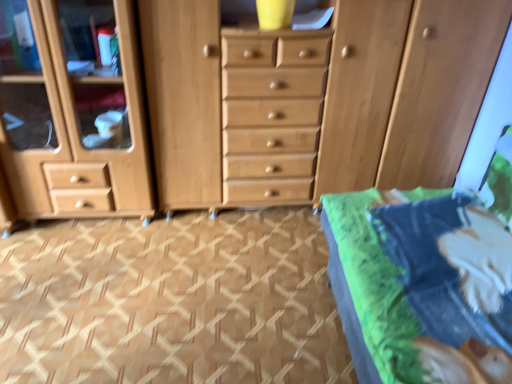
Question: From the image's perspective, is green fabric bed at lower right under brown textured carpet at center?

Choices:
 (A) no
 (B) yes

Answer: (A)

Question: Could you tell me if green fabric bed at lower right is turned towards brown textured carpet at center?

Choices:
 (A) no
 (B) yes

Answer: (B)

Question: From a real-world perspective, is green fabric bed at lower right positioned over brown textured carpet at center based on gravity?

Choices:
 (A) no
 (B) yes

Answer: (B)

Question: Is green fabric bed at lower right next to brown textured carpet at center?

Choices:
 (A) yes
 (B) no

Answer: (B)

Question: Does green fabric bed at lower right have a lesser height compared to brown textured carpet at center?

Choices:
 (A) yes
 (B) no

Answer: (B)

Question: Considering the positions of green fabric bed at lower right and brown textured carpet at center in the image, is green fabric bed at lower right bigger or smaller than brown textured carpet at center?

Choices:
 (A) big
 (B) small

Answer: (A)

Question: Considering the positions of point (429, 193) and point (150, 233), is point (429, 193) closer or farther from the camera than point (150, 233)?

Choices:
 (A) farther
 (B) closer

Answer: (B)

Question: Is green fabric bed at lower right wider or thinner than brown textured carpet at center?

Choices:
 (A) wide
 (B) thin

Answer: (B)

Question: From the image's perspective, is green fabric bed at lower right positioned above or below brown textured carpet at center?

Choices:
 (A) below
 (B) above

Answer: (B)

Question: Relative to green fabric bed at lower right, is brown textured carpet at center in front or behind?

Choices:
 (A) behind
 (B) front

Answer: (A)

Question: Choose the correct answer: Is brown textured carpet at center inside green fabric bed at lower right or outside it?

Choices:
 (A) outside
 (B) inside

Answer: (A)

Question: In terms of size, does brown textured carpet at center appear bigger or smaller than green fabric bed at lower right?

Choices:
 (A) big
 (B) small

Answer: (B)

Question: Considering the positions of point (23, 254) and point (377, 339), is point (23, 254) closer or farther from the camera than point (377, 339)?

Choices:
 (A) closer
 (B) farther

Answer: (B)

Question: From the image's perspective, is brown textured carpet at center above or below light brown wood chest of drawers at center?

Choices:
 (A) below
 (B) above

Answer: (A)

Question: Considering their positions, is brown textured carpet at center located in front of or behind light brown wood chest of drawers at center?

Choices:
 (A) front
 (B) behind

Answer: (A)